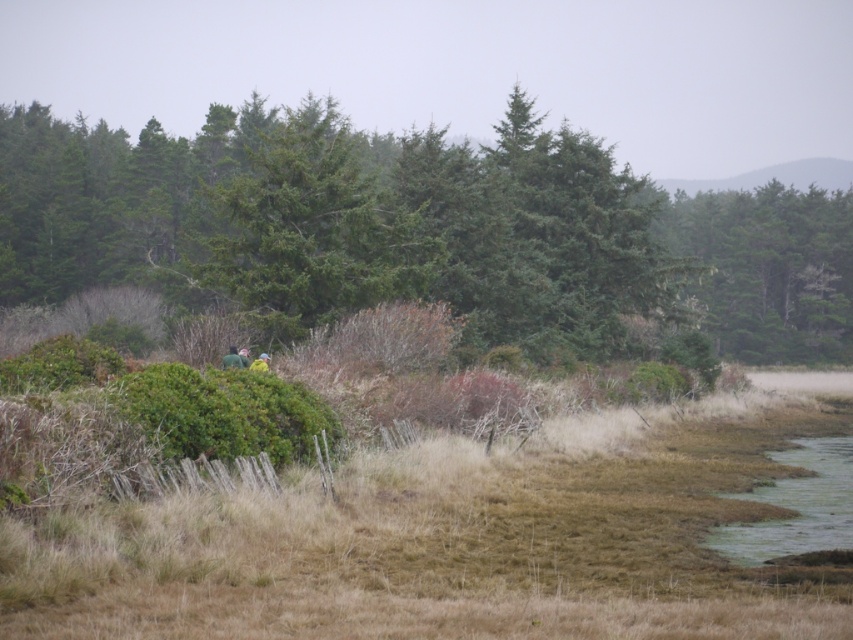
Question: Which is nearer to the green matte jacket at center?

Choices:
 (A) green textured tree at center
 (B) green matte tree at right

Answer: (A)

Question: Estimate the real-world distances between objects in this image. Which object is farther from the brown dry grass at center?

Choices:
 (A) green textured tree at center
 (B) green matte tree at right

Answer: (B)

Question: Is brown dry grass at center closer to camera compared to green matte jacket at center?

Choices:
 (A) no
 (B) yes

Answer: (B)

Question: Among these objects, which one is farthest from the camera?

Choices:
 (A) green textured tree at center
 (B) green fuzzy jacket at center

Answer: (A)

Question: Is green matte tree at right below green matte jacket at center?

Choices:
 (A) no
 (B) yes

Answer: (A)

Question: Is brown dry grass at center smaller than green matte jacket at center?

Choices:
 (A) yes
 (B) no

Answer: (B)